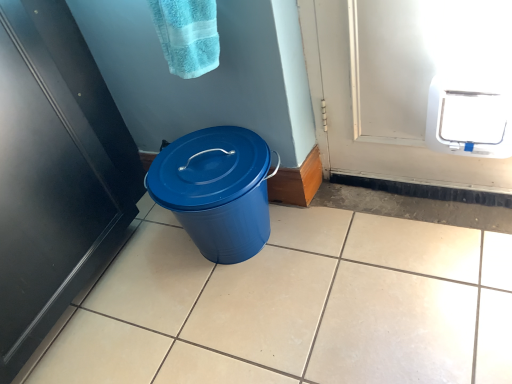
Where is `vacant space underneath blue plastic trash can at center (from a real-world perspective)`? Image resolution: width=512 pixels, height=384 pixels. vacant space underneath blue plastic trash can at center (from a real-world perspective) is located at coordinates (253, 256).